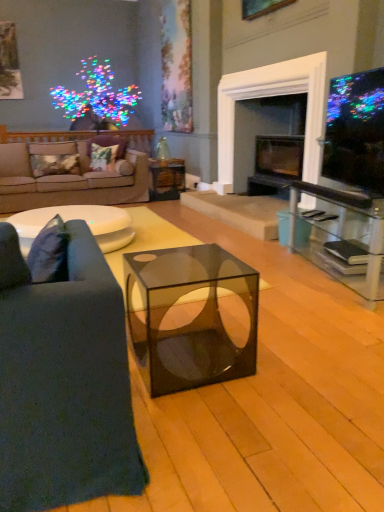
Locate an element on the screen. free spot behind transparent glass cube at center is located at coordinates (190, 322).